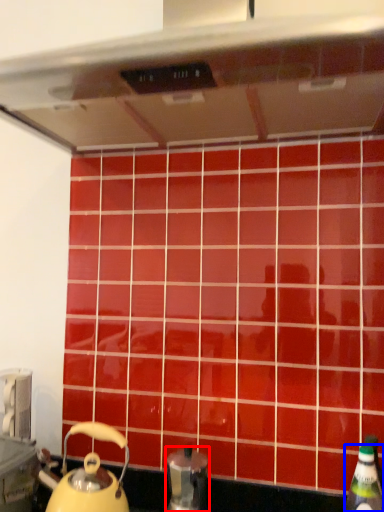
Question: Which object is closer to the camera taking this photo, kitchen appliance (highlighted by a red box) or bottle (highlighted by a blue box)?

Choices:
 (A) kitchen appliance
 (B) bottle

Answer: (B)